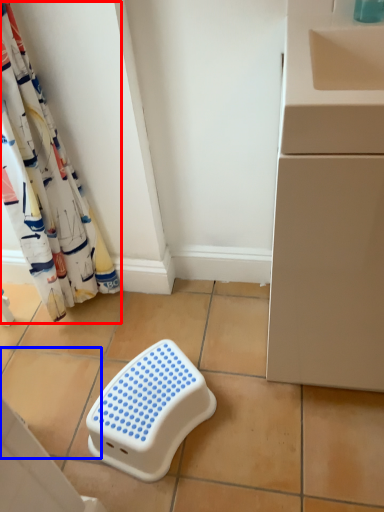
Question: Which object is closer to the camera taking this photo, curtain (highlighted by a red box) or ceramic tile (highlighted by a blue box)?

Choices:
 (A) curtain
 (B) ceramic tile

Answer: (A)